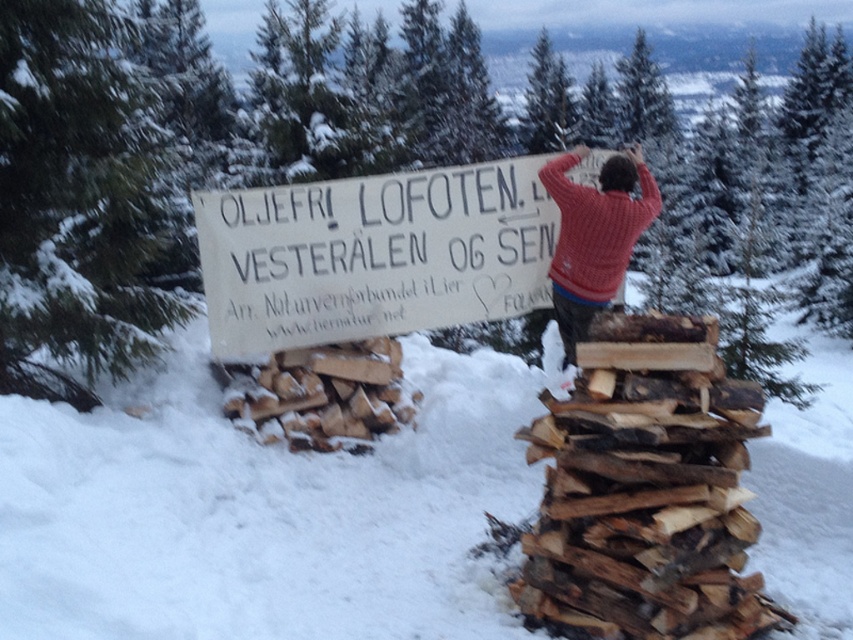
Question: Does green textured pine at upper left have a greater width compared to white paper sign at center?

Choices:
 (A) yes
 (B) no

Answer: (A)

Question: Estimate the real-world distances between objects in this image. Which object is closer to the natural wood at right?

Choices:
 (A) knitted wool sweater at upper right
 (B) white paper sign at center
 (C) woodenroughlogs at left
 (D) green textured pine at upper left

Answer: (A)

Question: Which point is farther to the camera?

Choices:
 (A) (352, 237)
 (B) (764, 449)
 (C) (489, 150)
 (D) (602, 188)

Answer: (C)

Question: Considering the relative positions of white powdery snow at center and green textured pine at upper left in the image provided, where is white powdery snow at center located with respect to green textured pine at upper left?

Choices:
 (A) above
 (B) below

Answer: (B)

Question: Does white powdery snow at center have a greater width compared to woodenroughlogs at left?

Choices:
 (A) no
 (B) yes

Answer: (B)

Question: Which point appears closest to the camera in this image?

Choices:
 (A) (724, 634)
 (B) (579, 289)
 (C) (364, 252)
 (D) (788, 484)

Answer: (A)